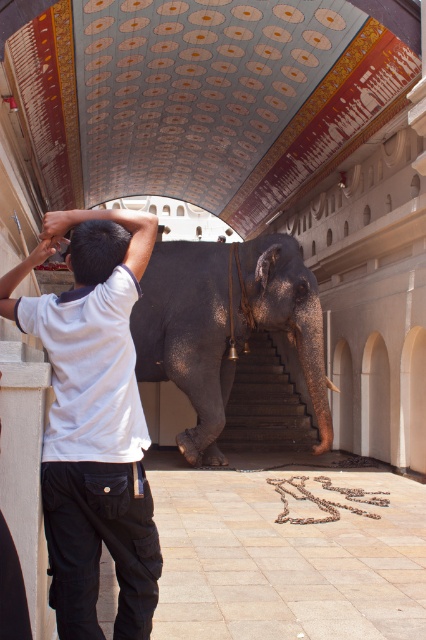
Question: Does gray textured elephant at center have a smaller size compared to dark gray stone stairs at center?

Choices:
 (A) yes
 (B) no

Answer: (B)

Question: Considering the real-world distances, which object is farthest from the gray textured elephant at center?

Choices:
 (A) white cotton shirt at left
 (B) dark gray stone stairs at center

Answer: (A)

Question: Where is white cotton shirt at left located in relation to dark gray stone stairs at center in the image?

Choices:
 (A) above
 (B) below

Answer: (A)

Question: Which of the following is the farthest from the observer?

Choices:
 (A) (273, 289)
 (B) (60, 380)
 (C) (282, 394)

Answer: (C)

Question: Which object is closer to the camera taking this photo?

Choices:
 (A) dark gray stone stairs at center
 (B) gray textured elephant at center

Answer: (B)

Question: Does white cotton shirt at left have a lesser width compared to gray textured elephant at center?

Choices:
 (A) no
 (B) yes

Answer: (A)